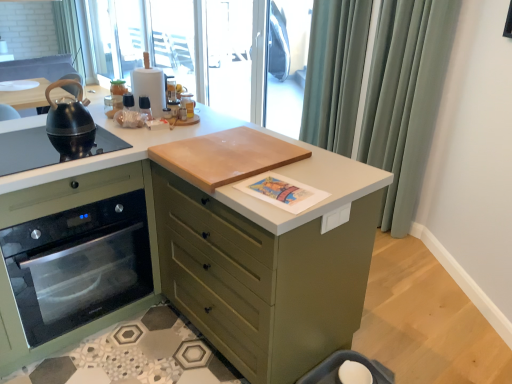
Image resolution: width=512 pixels, height=384 pixels. Find the location of `free point above black matte gas stove at left (from a real-world perspective)`. free point above black matte gas stove at left (from a real-world perspective) is located at coordinates [34, 143].